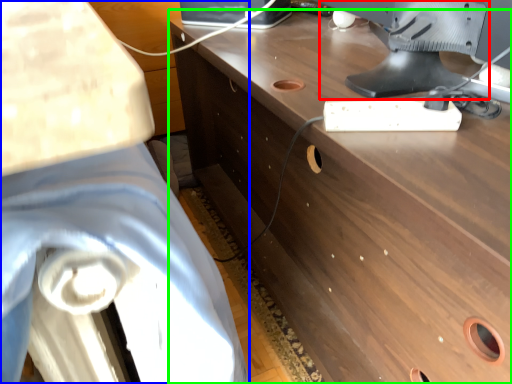
Question: Which object is positioned closest to computer monitor (highlighted by a red box)? Select from swivel chair (highlighted by a blue box) and desk (highlighted by a green box).

Choices:
 (A) swivel chair
 (B) desk

Answer: (B)